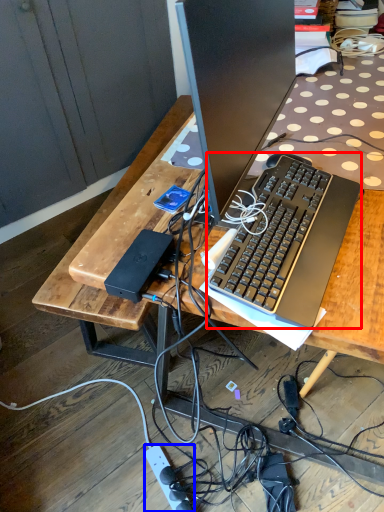
Question: Which of the following is the closest to the observer, computer keyboard (highlighted by a red box) or power outlet (highlighted by a blue box)?

Choices:
 (A) computer keyboard
 (B) power outlet

Answer: (A)